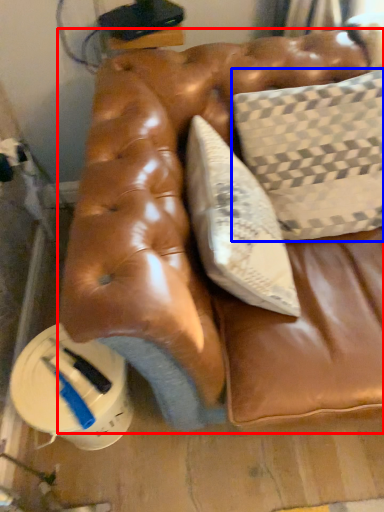
Question: Which of the following is the farthest to the observer, furniture (highlighted by a red box) or pillow (highlighted by a blue box)?

Choices:
 (A) furniture
 (B) pillow

Answer: (B)